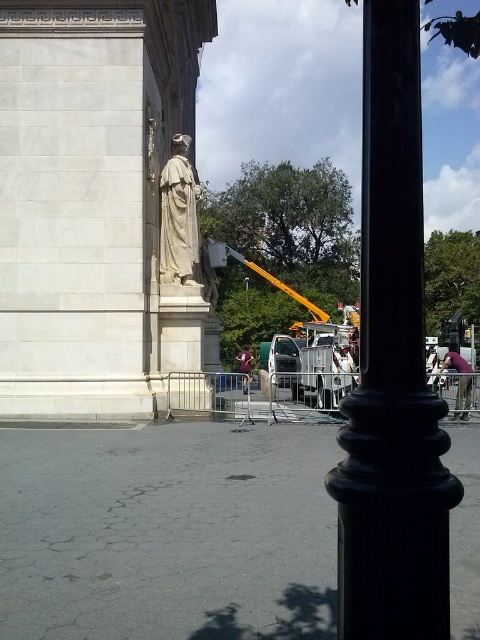
Does white stone statue at center appear on the left side of green fabric jacket at center?

Yes, white stone statue at center is to the left of green fabric jacket at center.

The height and width of the screenshot is (640, 480). What do you see at coordinates (179, 216) in the screenshot? I see `white stone statue at center` at bounding box center [179, 216].

Locate an element on the screen. This screenshot has width=480, height=640. white stone statue at center is located at coordinates (179, 216).

Does matte black jacket at lower right have a greater height compared to green fabric jacket at center?

In fact, matte black jacket at lower right may be shorter than green fabric jacket at center.

Who is more distant from viewer, [464,371] or [240,364]?

Point [240,364]

This screenshot has height=640, width=480. In order to click on matte black jacket at lower right in this screenshot , I will do [459, 380].

Between point (430, 412) and point (240, 356), which one is positioned in front?

Positioned in front is point (430, 412).

Between black polished pole at center and green fabric jacket at center, which one appears on the right side from the viewer's perspective?

black polished pole at center is more to the right.

Which is in front, point (418, 396) or point (239, 355)?

Point (418, 396) is in front.

Locate an element on the screen. This screenshot has width=480, height=640. black polished pole at center is located at coordinates (392, 371).